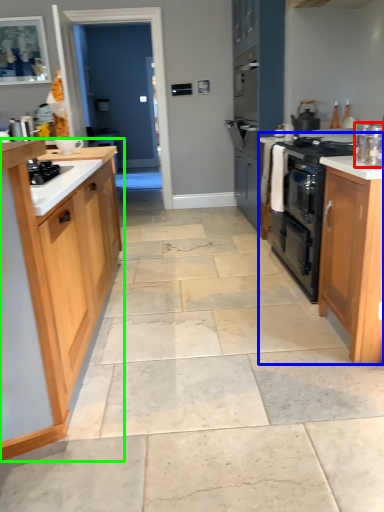
Question: Considering the real-world distances, which object is closest to kitchen appliance (highlighted by a red box)? counter (highlighted by a blue box) or cabinetry (highlighted by a green box).

Choices:
 (A) counter
 (B) cabinetry

Answer: (A)